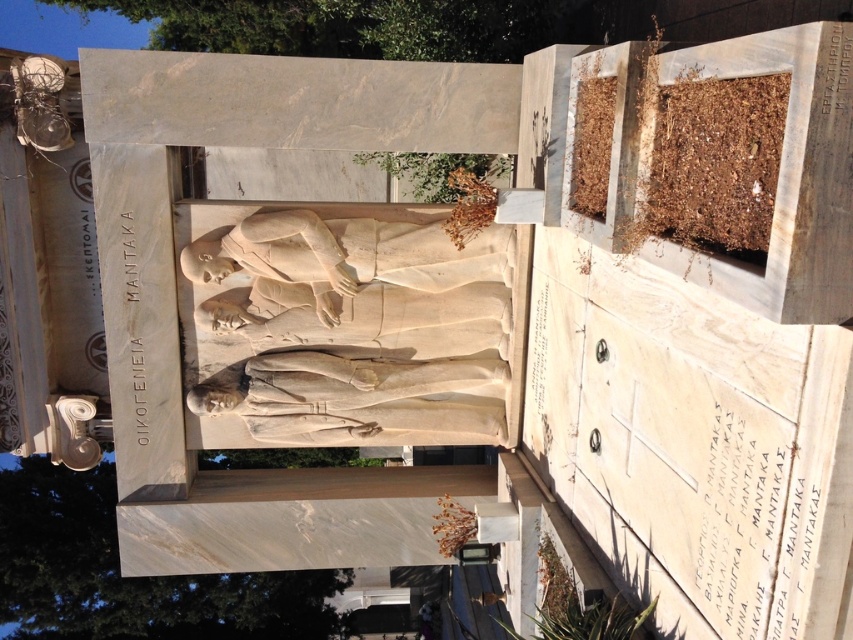
Question: Is the position of white marble statue at center more distant than that of black marble inscription at lower right?

Choices:
 (A) no
 (B) yes

Answer: (B)

Question: Which object appears farthest from the camera in this image?

Choices:
 (A) white marble text at center-left
 (B) black marble inscription at lower right
 (C) white marble statue at center

Answer: (A)

Question: Is white marble statue at center thinner than white marble text at center-left?

Choices:
 (A) no
 (B) yes

Answer: (A)

Question: Which object appears closest to the camera in this image?

Choices:
 (A) white marble text at center-left
 (B) black marble inscription at lower right
 (C) white marble statue at center

Answer: (B)

Question: Can you confirm if black marble inscription at lower right is wider than white marble text at center-left?

Choices:
 (A) no
 (B) yes

Answer: (A)

Question: Which point appears closest to the camera in this image?

Choices:
 (A) (448, 333)
 (B) (128, 406)

Answer: (B)